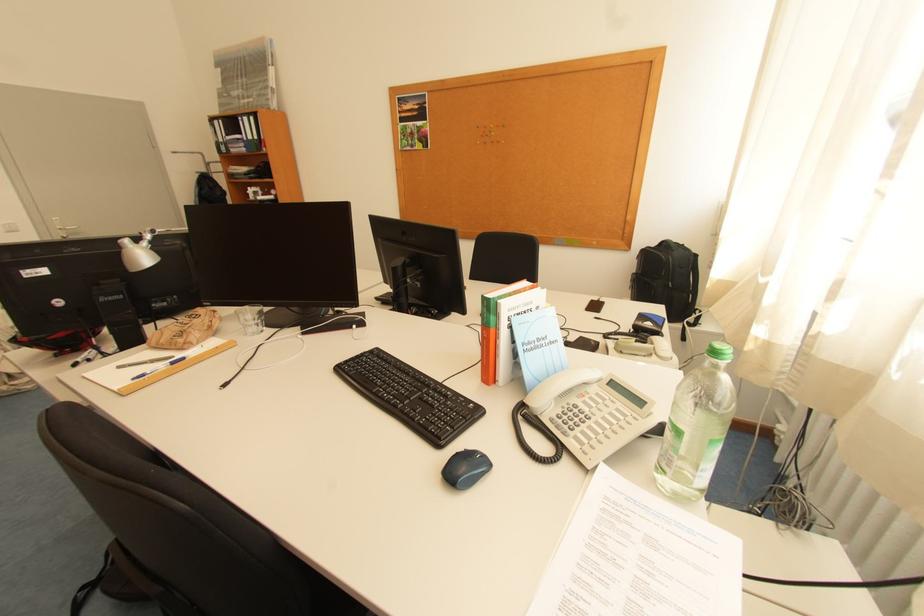
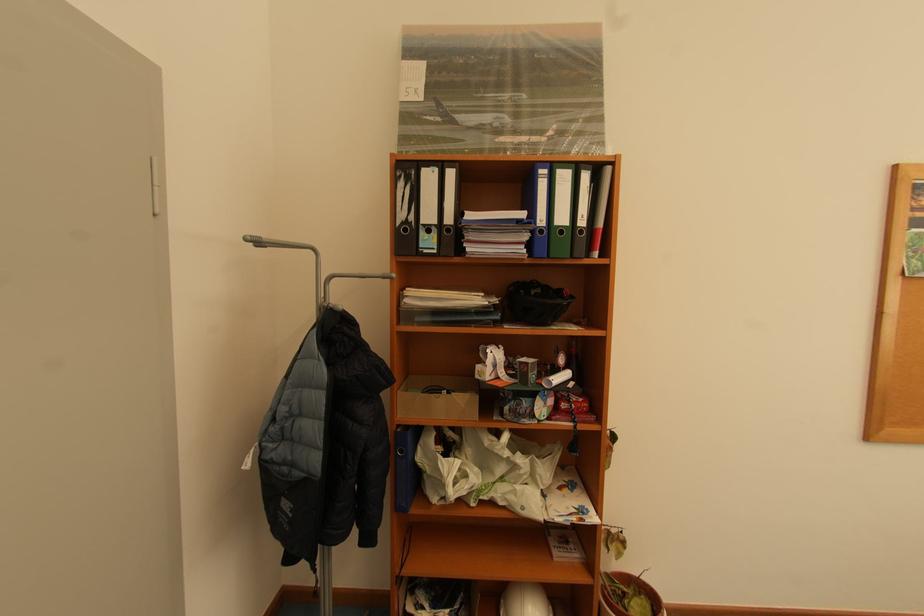
Where in the second image is the point corresponding to the point at 224,140 from the first image?

(409, 217)